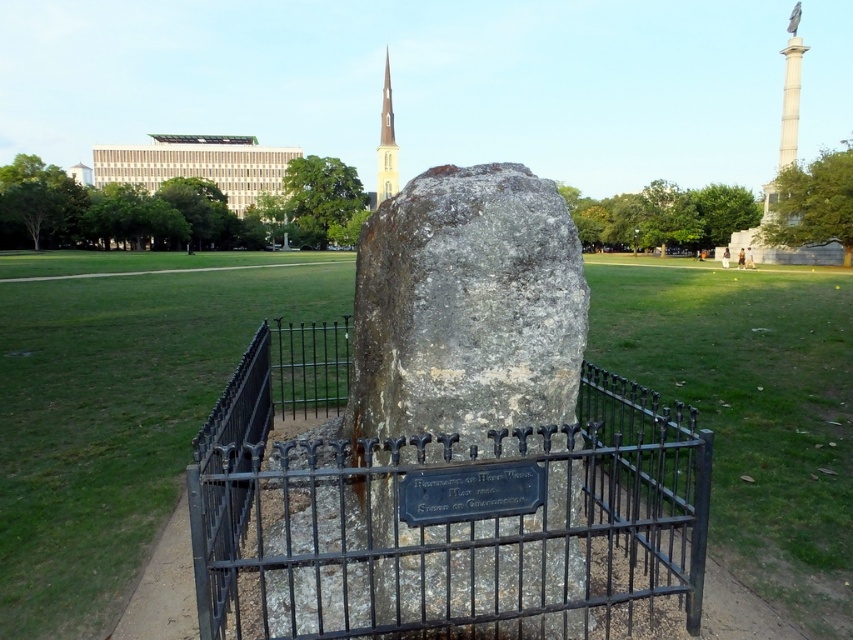
Is point (479, 595) more distant than point (387, 182)?

That is False.

How much distance is there between black wrought iron fence at center and smooth white spire at upper center?

black wrought iron fence at center is 353.75 feet from smooth white spire at upper center.

Is point (627, 560) less distant than point (384, 115)?

Yes, it is.

I want to click on black wrought iron fence at center, so [x=438, y=512].

Who is positioned more to the left, black wrought iron fence at center or gray stone at center?

gray stone at center is more to the left.

Between black wrought iron fence at center and gray stone at center, which one is positioned lower?

black wrought iron fence at center is lower down.

Where is `black wrought iron fence at center`? black wrought iron fence at center is located at coordinates 438,512.

Does gray stone at center have a lesser width compared to smooth white spire at upper center?

Correct, gray stone at center's width is less than smooth white spire at upper center's.

Can you confirm if gray stone at center is positioned above smooth white spire at upper center?

Actually, gray stone at center is below smooth white spire at upper center.

Who is more distant from viewer, (549, 628) or (384, 115)?

The point (384, 115) is behind.

You are a GUI agent. You are given a task and a screenshot of the screen. Output one action in this format:
    pyautogui.click(x=<x>, y=<y>)
    Task: Click on the gray stone at center
    The width and height of the screenshot is (853, 640).
    Given the screenshot: What is the action you would take?
    pyautogui.click(x=468, y=312)